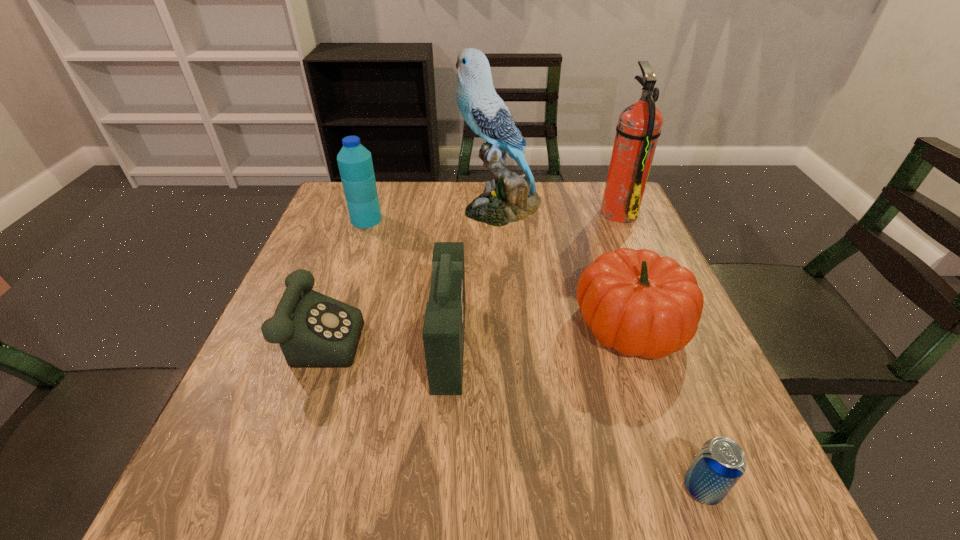
Image resolution: width=960 pixels, height=540 pixels. I want to click on vacant space that satisfies the following two spatial constraints: 1. on the front side of the pumpkin; 2. on the right side of the shortest object, so click(688, 488).

At what (x,y) coordinates should I click in order to perform the action: click on free space that satisfies the following two spatial constraints: 1. at the nozzle of the fire extinguisher; 2. on the front side of the fifth tallest object. Please return your answer as a coordinate pair (x, y). Image resolution: width=960 pixels, height=540 pixels. Looking at the image, I should click on (668, 325).